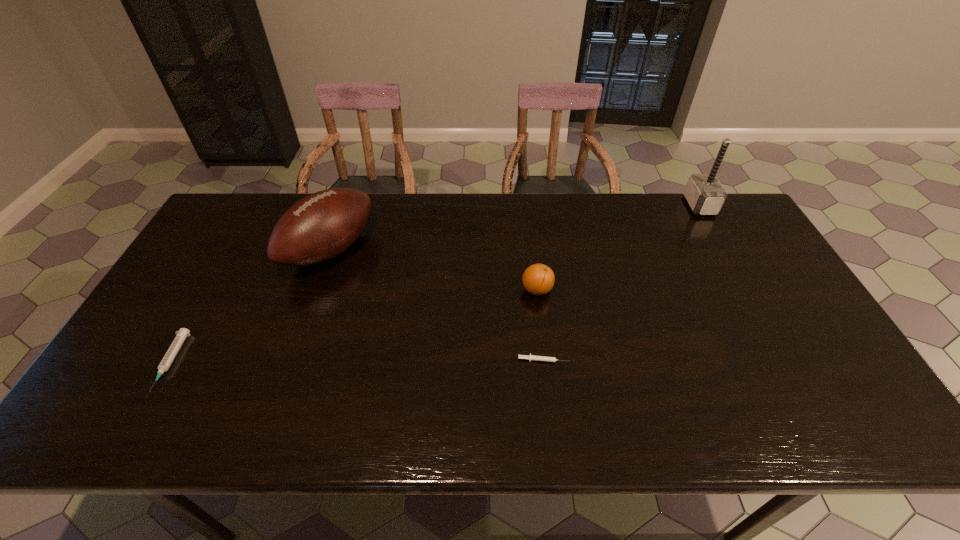
Find the location of `object present at the far right corner`. object present at the far right corner is located at coordinates (704, 193).

Image resolution: width=960 pixels, height=540 pixels. I want to click on free space at the far edge, so click(578, 227).

In the image, there is a desktop. Where is `vacant space at the near edge`? The width and height of the screenshot is (960, 540). vacant space at the near edge is located at coordinates (245, 425).

You are a GUI agent. You are given a task and a screenshot of the screen. Output one action in this format:
    pyautogui.click(x=<x>, y=<y>)
    Task: Click on the vacant space at the right edge of the desktop
    Image resolution: width=960 pixels, height=540 pixels.
    Given the screenshot: What is the action you would take?
    pyautogui.click(x=807, y=313)

I want to click on free space at the far left corner, so click(244, 197).

Image resolution: width=960 pixels, height=540 pixels. Find the location of `vacant space at the far right corner of the desktop`. vacant space at the far right corner of the desktop is located at coordinates (734, 212).

You are a GUI agent. You are given a task and a screenshot of the screen. Output one action in this format:
    pyautogui.click(x=<x>, y=<y>)
    Task: Click on the free space between the farthest object and the shorter syringe
    This screenshot has width=960, height=540.
    Given the screenshot: What is the action you would take?
    pyautogui.click(x=621, y=282)

This screenshot has width=960, height=540. Find the location of `blank region between the rightmost object and the fourth object from right to left`. blank region between the rightmost object and the fourth object from right to left is located at coordinates (515, 227).

Where is `blank region between the fourth tallest object and the rightmost object`? The width and height of the screenshot is (960, 540). blank region between the fourth tallest object and the rightmost object is located at coordinates (435, 284).

Where is `free spot between the orange and the football (American)`? free spot between the orange and the football (American) is located at coordinates (434, 270).